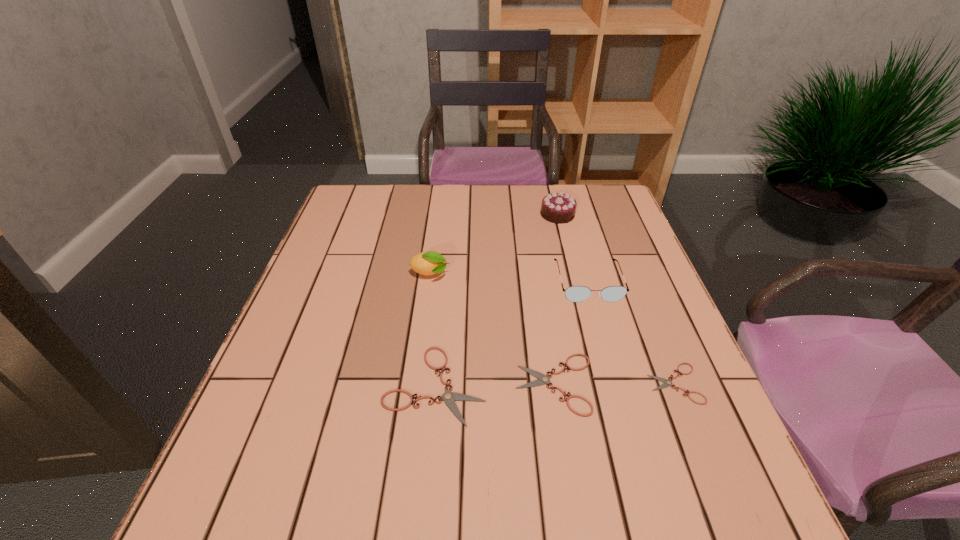
I want to click on vacant space that's between the lemon and the leftmost shears, so click(433, 329).

Image resolution: width=960 pixels, height=540 pixels. I want to click on unoccupied area between the second tallest shears and the leftmost shears, so click(x=495, y=384).

Locate an element on the screen. Image resolution: width=960 pixels, height=540 pixels. vacant area that lies between the shortest object and the lemon is located at coordinates (552, 329).

Locate an element on the screen. Image resolution: width=960 pixels, height=540 pixels. vacant point located between the spectacles and the leftmost shears is located at coordinates (512, 333).

The width and height of the screenshot is (960, 540). What are the coordinates of `free spot between the leftmost shears and the rightmost shears` in the screenshot? It's located at (555, 384).

I want to click on vacant space in between the shortest shears and the fourth shortest object, so click(x=631, y=333).

The image size is (960, 540). I want to click on free spot between the lemon and the shortest object, so click(552, 329).

What are the coordinates of `object that is the second nearest to the second shortest shears` in the screenshot? It's located at (667, 383).

Locate which object is the second closest to the lemon. Please provide its 2D coordinates. Your answer should be formatted as a tuple, i.e. [(x, y)], where the tuple contains the x and y coordinates of a point satisfying the conditions above.

[(574, 293)]

Where is `shears that can be found as the third closest to the farthest object`? The width and height of the screenshot is (960, 540). shears that can be found as the third closest to the farthest object is located at coordinates (667, 383).